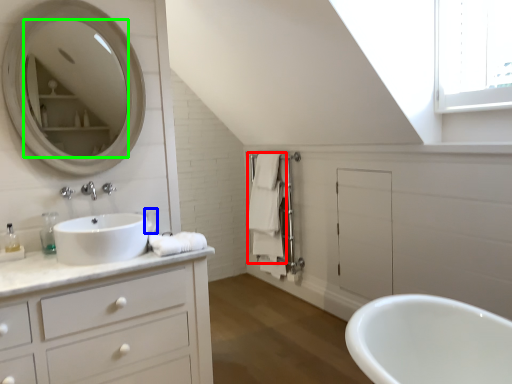
Question: Which object is positioned farthest from bath towel (highlighted by a red box)? Select from toiletry (highlighted by a blue box) and mirror (highlighted by a green box).

Choices:
 (A) toiletry
 (B) mirror

Answer: (B)